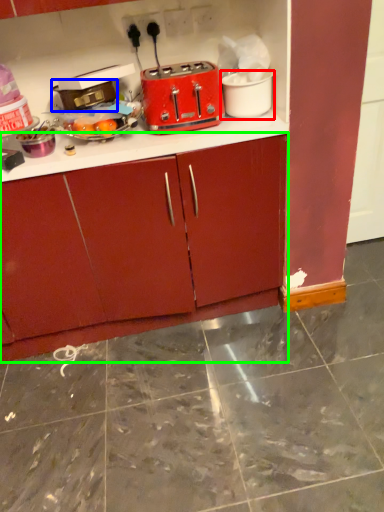
Question: Based on their relative distances, which object is farther from appliance (highlighted by a red box)? Choose from appliance (highlighted by a blue box) and cabinetry (highlighted by a green box).

Choices:
 (A) appliance
 (B) cabinetry

Answer: (B)